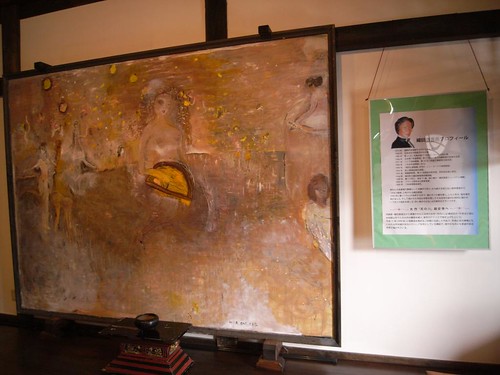
You are a GUI agent. You are given a task and a screenshot of the screen. Output one action in this format:
    pyautogui.click(x=<x>, y=<y>)
    Task: Click on the yellow paint
    
    Given the screenshot: What is the action you would take?
    pyautogui.click(x=173, y=175)